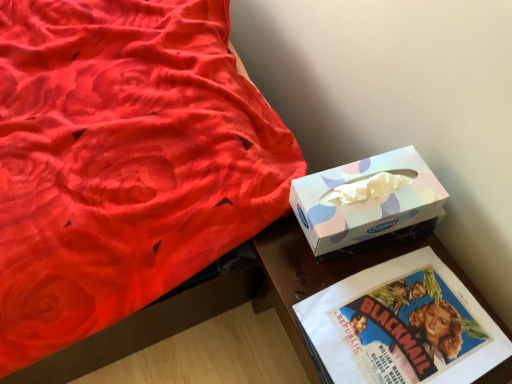
This screenshot has height=384, width=512. What do you see at coordinates (123, 161) in the screenshot?
I see `velvet red bed at upper left` at bounding box center [123, 161].

The image size is (512, 384). I want to click on pastel paper tissue box at right, so click(366, 203).

Does pastel paper tissue box at right turn towards wooden glossy table at lower right?

No.

From a real-world perspective, relative to wooden glossy table at lower right, is pastel paper tissue box at right vertically above or below?

Clearly, from a real-world perspective, pastel paper tissue box at right is above wooden glossy table at lower right.

Which of these two, pastel paper tissue box at right or wooden glossy table at lower right, stands taller?

pastel paper tissue box at right is taller.

Does wooden glossy table at lower right have a larger size compared to pastel paper tissue box at right?

Actually, wooden glossy table at lower right might be smaller than pastel paper tissue box at right.

How distant is wooden glossy table at lower right from pastel paper tissue box at right?

wooden glossy table at lower right and pastel paper tissue box at right are 4.70 inches apart.

Is wooden glossy table at lower right taller or shorter than pastel paper tissue box at right?

In the image, wooden glossy table at lower right appears to be shorter than pastel paper tissue box at right.

Based on their positions, is wooden glossy table at lower right located to the left or right of pastel paper tissue box at right?

Clearly, wooden glossy table at lower right is on the right of pastel paper tissue box at right in the image.

Image resolution: width=512 pixels, height=384 pixels. In order to click on bed on the left of pastel paper tissue box at right in this screenshot , I will do `click(123, 161)`.

Is velvet red bed at upper left at the left side of pastel paper tissue box at right?

Indeed, velvet red bed at upper left is positioned on the left side of pastel paper tissue box at right.

Is point (253, 157) positioned before point (326, 210)?

No.

Is wooden glossy table at lower right placed right next to velvet red bed at upper left?

No, wooden glossy table at lower right is not touching velvet red bed at upper left.

Could you tell me if wooden glossy table at lower right is turned towards velvet red bed at upper left?

No, wooden glossy table at lower right is not facing towards velvet red bed at upper left.

Is wooden glossy table at lower right further to the viewer compared to velvet red bed at upper left?

Yes, it is behind velvet red bed at upper left.

Which of these two, pastel paper tissue box at right or velvet red bed at upper left, is wider?

velvet red bed at upper left is wider.

From the image's perspective, which one is positioned lower, pastel paper tissue box at right or velvet red bed at upper left?

pastel paper tissue box at right appears lower in the image.

Is pastel paper tissue box at right beside velvet red bed at upper left?

They are not placed beside each other.

Considering the sizes of velvet red bed at upper left and wooden glossy table at lower right in the image, is velvet red bed at upper left wider or thinner than wooden glossy table at lower right?

Clearly, velvet red bed at upper left has more width compared to wooden glossy table at lower right.

Can you tell me how much velvet red bed at upper left and wooden glossy table at lower right differ in facing direction?

They differ by 177 degrees in their facing directions.

Locate an element on the screen. The width and height of the screenshot is (512, 384). table on the right of velvet red bed at upper left is located at coordinates [329, 273].

Which object is more forward, velvet red bed at upper left or wooden glossy table at lower right?

velvet red bed at upper left is more forward.

Where is `table to the right of pastel paper tissue box at right`? The height and width of the screenshot is (384, 512). table to the right of pastel paper tissue box at right is located at coordinates (329, 273).

This screenshot has height=384, width=512. Identify the location of box on the left of wooden glossy table at lower right. (366, 203).

When comparing their distances from pastel paper tissue box at right, does velvet red bed at upper left or wooden glossy table at lower right seem further?

velvet red bed at upper left is positioned further to the anchor pastel paper tissue box at right.

Which object lies nearer to the anchor point velvet red bed at upper left, wooden glossy table at lower right or pastel paper tissue box at right?

The object closer to velvet red bed at upper left is wooden glossy table at lower right.

From the image, which object appears to be farther from wooden glossy table at lower right, pastel paper tissue box at right or velvet red bed at upper left?

velvet red bed at upper left is positioned further to the anchor wooden glossy table at lower right.

Based on their spatial positions, is pastel paper tissue box at right or wooden glossy table at lower right further from velvet red bed at upper left?

Among the two, pastel paper tissue box at right is located further to velvet red bed at upper left.

From the picture: Looking at the image, which one is located further to wooden glossy table at lower right, velvet red bed at upper left or pastel paper tissue box at right?

Based on the image, velvet red bed at upper left appears to be further to wooden glossy table at lower right.

Looking at the image, which one is located further to pastel paper tissue box at right, wooden glossy table at lower right or velvet red bed at upper left?

velvet red bed at upper left is positioned further to the anchor pastel paper tissue box at right.

You are a GUI agent. You are given a task and a screenshot of the screen. Output one action in this format:
    pyautogui.click(x=<x>, y=<y>)
    Task: Click on the box located between velvet red bed at upper left and wooden glossy table at lower right in the left-right direction
    The width and height of the screenshot is (512, 384).
    Given the screenshot: What is the action you would take?
    pyautogui.click(x=366, y=203)